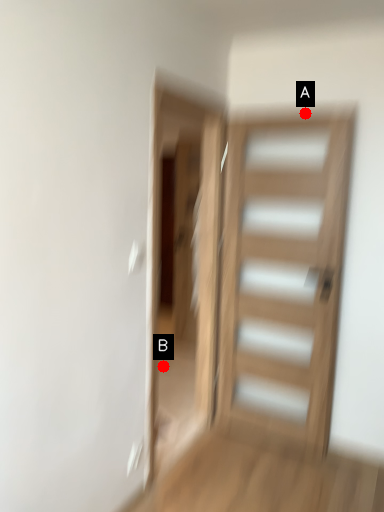
Question: Two points are circled on the image, labeled by A and B beside each circle. Which point is farther to the camera?

Choices:
 (A) A is further
 (B) B is further

Answer: (B)